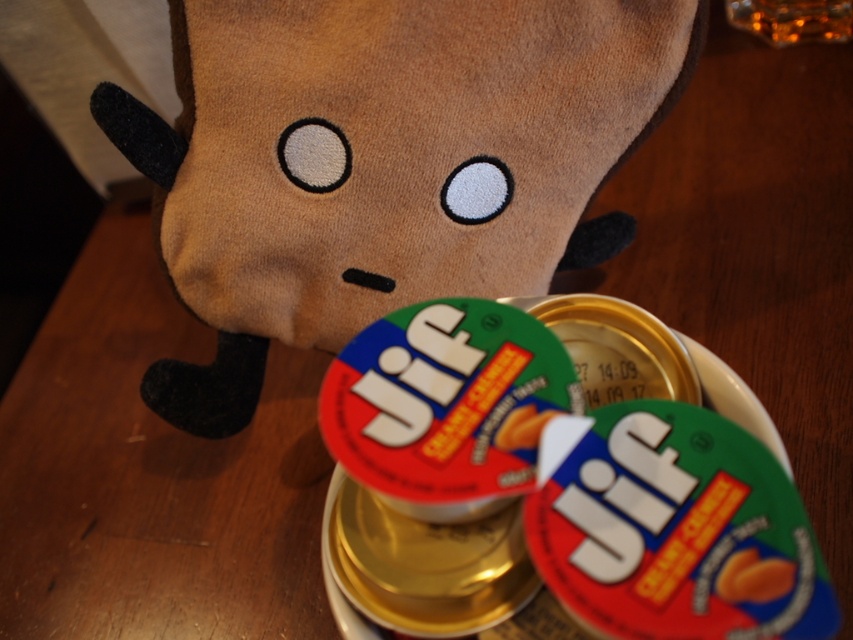
Question: Is smooth orange almond butter at center above smooth plastic peanut butter cup at center?

Choices:
 (A) yes
 (B) no

Answer: (B)

Question: Based on their relative distances, which object is nearer to the smooth plastic peanut butter cup at center?

Choices:
 (A) brown plush toy at upper center
 (B) smooth orange almond butter at center

Answer: (B)

Question: Considering the relative positions of brown plush toy at upper center and smooth orange almond butter at center in the image provided, where is brown plush toy at upper center located with respect to smooth orange almond butter at center?

Choices:
 (A) left
 (B) right

Answer: (A)

Question: Does brown plush toy at upper center appear on the right side of smooth orange almond butter at center?

Choices:
 (A) yes
 (B) no

Answer: (B)

Question: Which is farther from the smooth plastic peanut butter cup at center?

Choices:
 (A) smooth orange almond butter at center
 (B) brown plush toy at upper center

Answer: (B)

Question: Which point is closer to the camera taking this photo?

Choices:
 (A) 325,273
 (B) 772,593

Answer: (B)